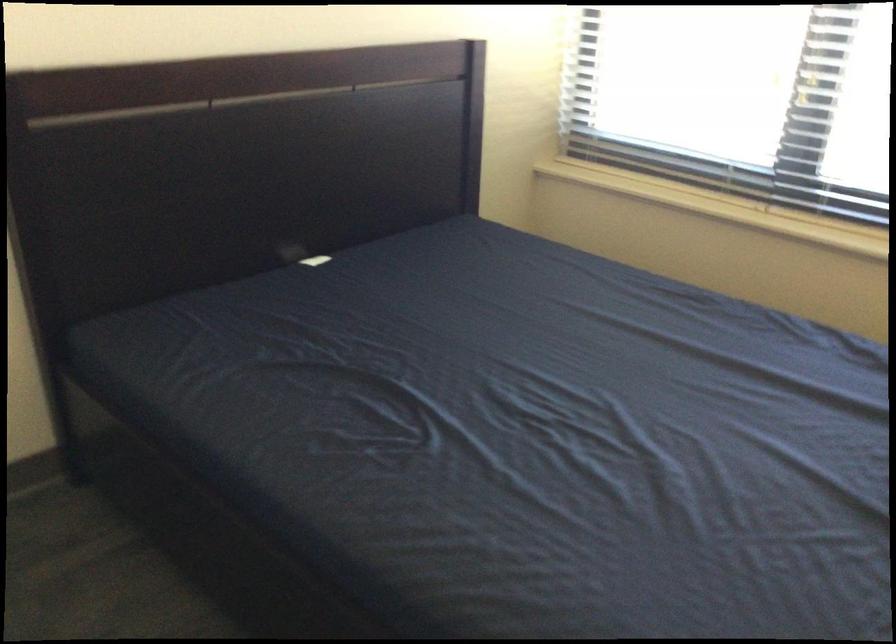
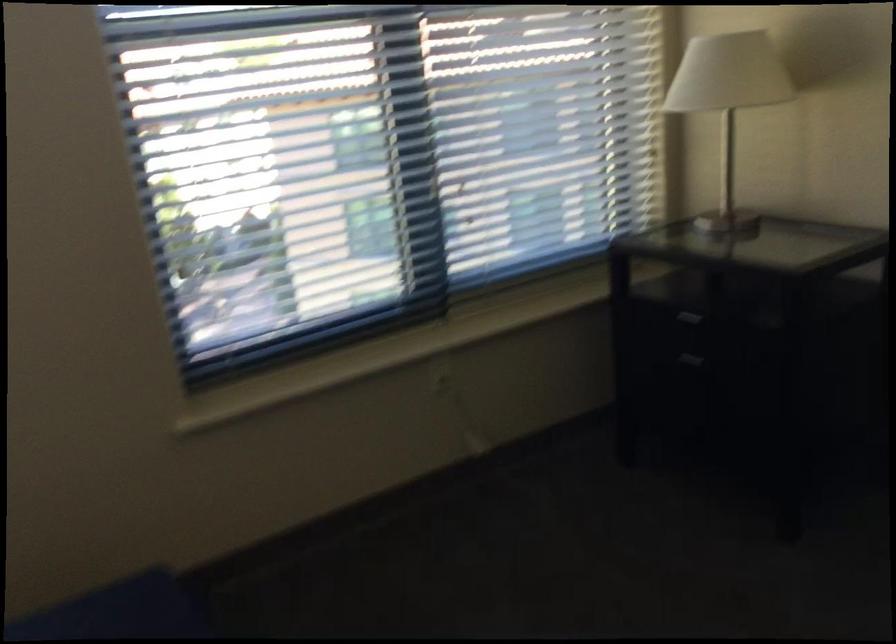
Question: The images are taken continuously from a first-person perspective. In which direction is your viewpoint rotating?

Choices:
 (A) Left
 (B) Right
 (C) Up
 (D) Down

Answer: (B)